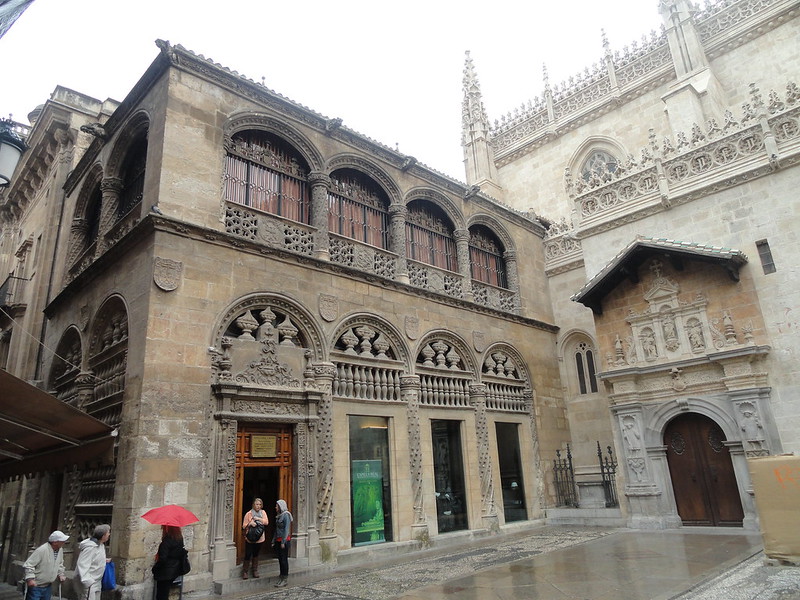
You are a GUI agent. You are given a task and a screenshot of the screen. Output one action in this format:
    pyautogui.click(x=<x>, y=<y>)
    Task: Click on the door
    The width and height of the screenshot is (800, 600).
    Given the screenshot: What is the action you would take?
    pyautogui.click(x=721, y=492)